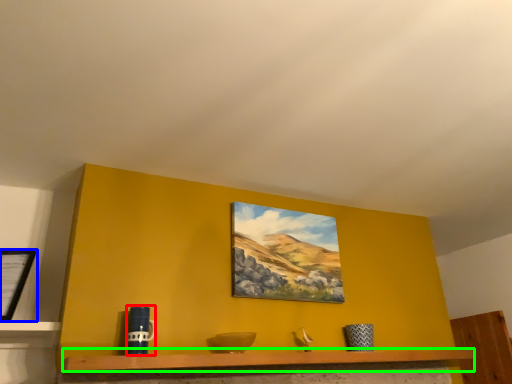
Question: Estimate the real-world distances between objects in this image. Which object is closer to mug (highlighted by a red box), picture frame (highlighted by a blue box) or shelf (highlighted by a green box)?

Choices:
 (A) picture frame
 (B) shelf

Answer: (B)